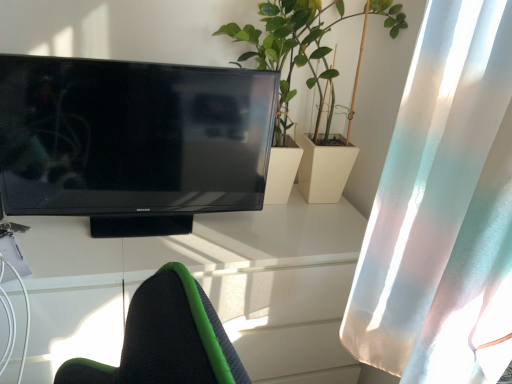
Question: Can you confirm if matte black television at left is smaller than translucent white curtain at right?

Choices:
 (A) no
 (B) yes

Answer: (B)

Question: Is matte black television at left far from translucent white curtain at right?

Choices:
 (A) yes
 (B) no

Answer: (B)

Question: From the image's perspective, would you say matte black television at left is positioned over translucent white curtain at right?

Choices:
 (A) no
 (B) yes

Answer: (B)

Question: Would you say matte black television at left contains translucent white curtain at right?

Choices:
 (A) no
 (B) yes

Answer: (A)

Question: Is matte black television at left to the right of translucent white curtain at right from the viewer's perspective?

Choices:
 (A) yes
 (B) no

Answer: (B)

Question: Considering the relative sizes of matte black television at left and translucent white curtain at right in the image provided, is matte black television at left bigger than translucent white curtain at right?

Choices:
 (A) no
 (B) yes

Answer: (A)

Question: Is the depth of green leafy plant at center greater than that of translucent white curtain at right?

Choices:
 (A) yes
 (B) no

Answer: (A)

Question: Could you tell me if green leafy plant at center is facing translucent white curtain at right?

Choices:
 (A) yes
 (B) no

Answer: (A)

Question: Is green leafy plant at center surrounding translucent white curtain at right?

Choices:
 (A) yes
 (B) no

Answer: (B)

Question: Is green leafy plant at center in contact with translucent white curtain at right?

Choices:
 (A) yes
 (B) no

Answer: (B)

Question: Is green leafy plant at center positioned far away from translucent white curtain at right?

Choices:
 (A) no
 (B) yes

Answer: (A)

Question: Is green leafy plant at center wider than translucent white curtain at right?

Choices:
 (A) no
 (B) yes

Answer: (B)

Question: Considering the relative sizes of white glossy desk at center and translucent white curtain at right in the image provided, is white glossy desk at center thinner than translucent white curtain at right?

Choices:
 (A) no
 (B) yes

Answer: (A)